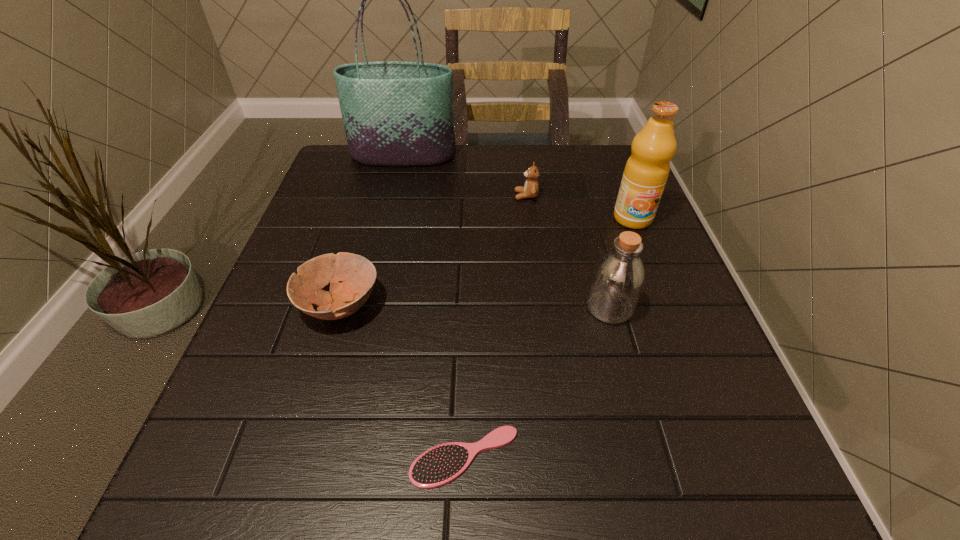
Identify which object is the second closest to the fourth object from left to right. Please provide its 2D coordinates. Your answer should be formatted as a tuple, i.e. [(x, y)], where the tuple contains the x and y coordinates of a point satisfying the conditions above.

[(395, 113)]

At what (x,y) coordinates should I click in order to perform the action: click on object that stands as the closest to the second tallest object. Please return your answer as a coordinate pair (x, y). Image resolution: width=960 pixels, height=540 pixels. Looking at the image, I should click on (531, 188).